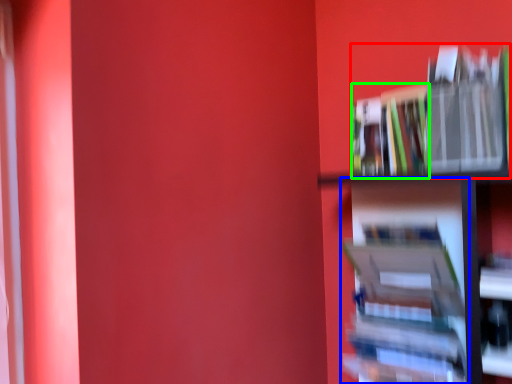
Question: Which object is the farthest from book (highlighted by a red box)? Choose among these: book (highlighted by a blue box) or book (highlighted by a green box).

Choices:
 (A) book
 (B) book

Answer: (A)